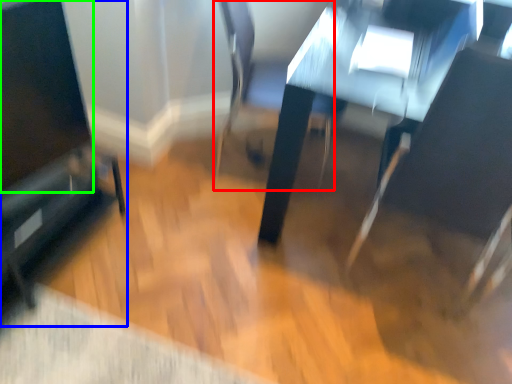
Question: Based on their relative distances, which object is nearer to swivel chair (highlighted by a red box)? Choose from furniture (highlighted by a blue box) and screen (highlighted by a green box).

Choices:
 (A) furniture
 (B) screen

Answer: (A)